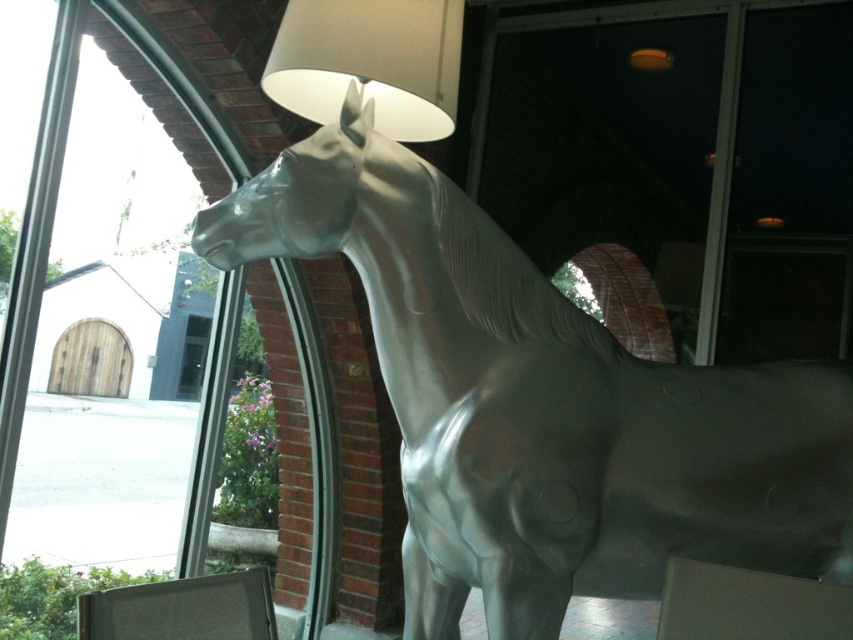
Who is more distant from viewer, (x=444, y=273) or (x=451, y=3)?

The point (x=451, y=3) is more distant.

Which is behind, point (496, 616) or point (387, 100)?

The point (387, 100) is behind.

Find the location of a particular element. This screenshot has width=853, height=640. shiny metallic horse at center is located at coordinates (543, 404).